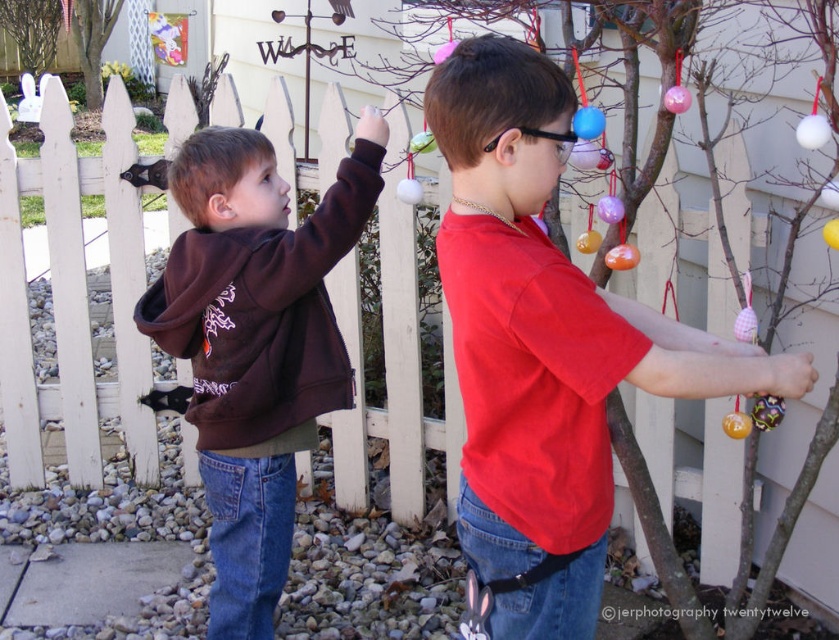
Question: Which of the following is the closest to the observer?

Choices:
 (A) (274, 388)
 (B) (546, 440)

Answer: (B)

Question: Which point is farther to the camera?

Choices:
 (A) matte red shirt at center
 (B) matte brown hoodie at left

Answer: (B)

Question: Is matte red shirt at center thinner than matte brown hoodie at left?

Choices:
 (A) no
 (B) yes

Answer: (A)

Question: Does matte red shirt at center lie in front of matte brown hoodie at left?

Choices:
 (A) no
 (B) yes

Answer: (B)

Question: Does matte red shirt at center appear over matte brown hoodie at left?

Choices:
 (A) no
 (B) yes

Answer: (B)